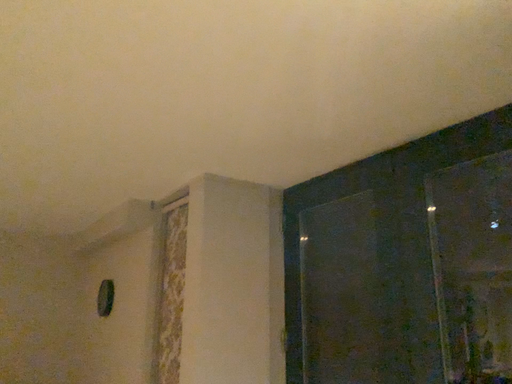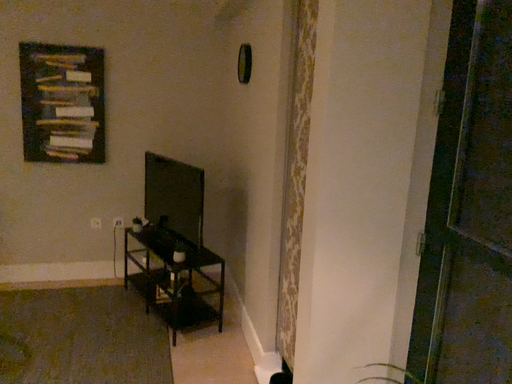
Question: Which way did the camera rotate in the video?

Choices:
 (A) rotated downward
 (B) rotated upward

Answer: (A)